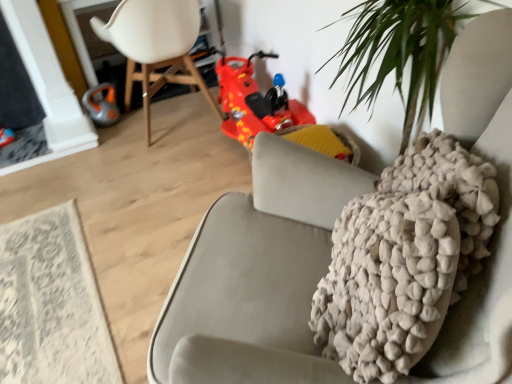
At what (x,y) coordinates should I click in order to perform the action: click on vacant space in front of shiny red plastic toy car at center. Please return your answer as a coordinate pair (x, y). Image resolution: width=512 pixels, height=384 pixels. Looking at the image, I should click on (212, 181).